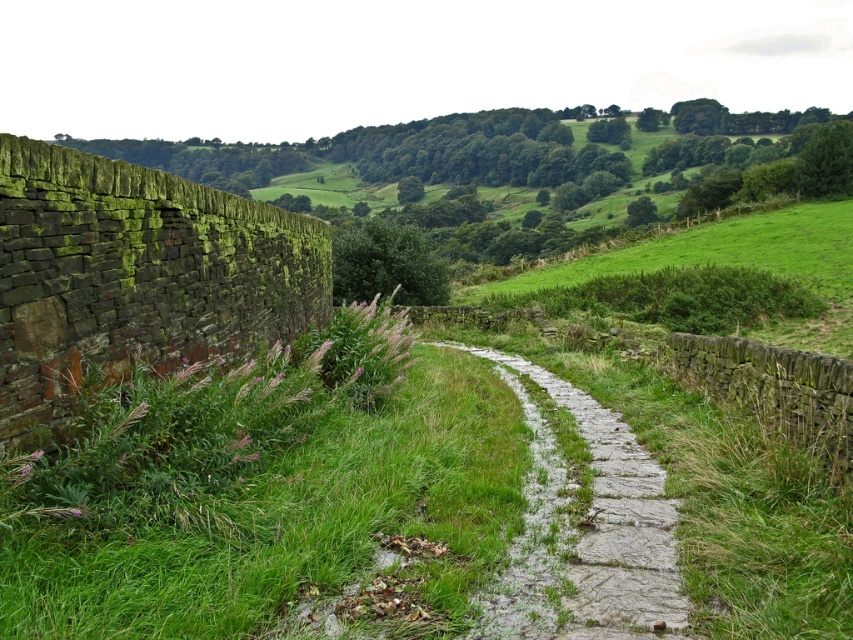
From the picture: You are standing at the point marked by the coordinate point at point (135,275). Which direction should you walk to reach the green mossy stone wall at left?

The green mossy stone wall at left is located to your left side, so you should walk towards your left to reach it.